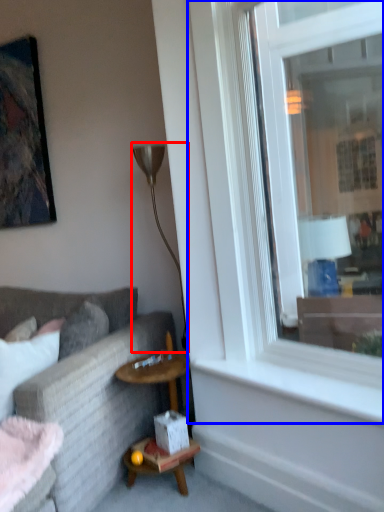
Question: Which object appears closest to the camera in this image, lamp (highlighted by a red box) or window (highlighted by a blue box)?

Choices:
 (A) lamp
 (B) window

Answer: (B)